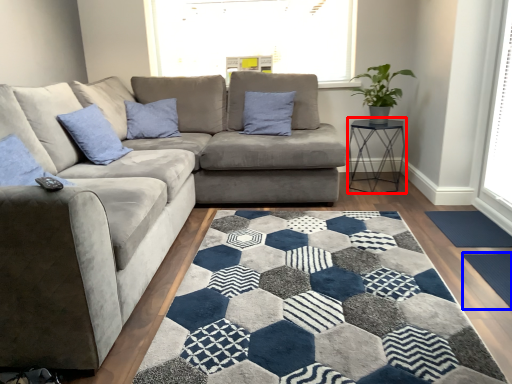
Question: Which point is closer to the camera, table (highlighted by a red box) or doormat (highlighted by a blue box)?

Choices:
 (A) table
 (B) doormat

Answer: (B)